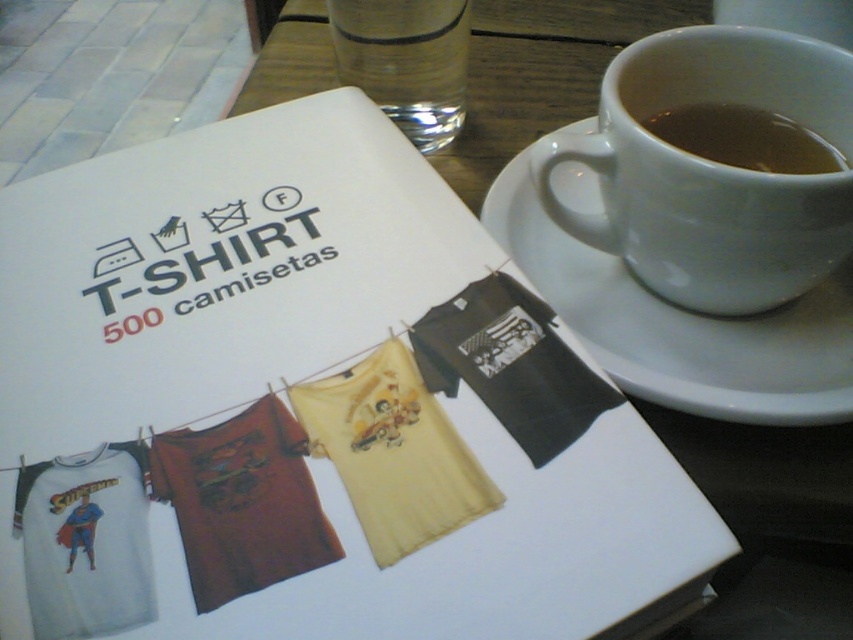
Question: Which of the following is the closest to the observer?

Choices:
 (A) (688, 353)
 (B) (654, 68)
 (C) (426, 33)
 (D) (778, 164)

Answer: (A)

Question: Which object is farther from the camera taking this photo?

Choices:
 (A) brown liquid at upper right
 (B) white ceramic saucer at upper right
 (C) white ceramic mug at upper right
 (D) clear glass water at upper center

Answer: (D)

Question: Is the position of clear glass water at upper center more distant than that of brown liquid at upper right?

Choices:
 (A) yes
 (B) no

Answer: (A)

Question: Estimate the real-world distances between objects in this image. Which object is farther from the clear glass water at upper center?

Choices:
 (A) brown liquid at upper right
 (B) white ceramic mug at upper right
 (C) white ceramic saucer at upper right

Answer: (B)

Question: Can you confirm if white ceramic saucer at upper right is positioned below clear glass water at upper center?

Choices:
 (A) no
 (B) yes

Answer: (B)

Question: Does white ceramic saucer at upper right appear on the left side of clear glass water at upper center?

Choices:
 (A) yes
 (B) no

Answer: (B)